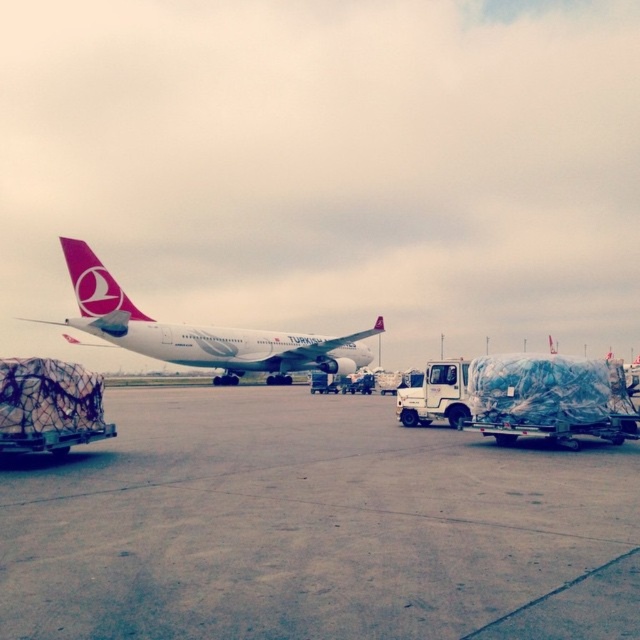
Can you confirm if concrete tarmac at center is wider than pink matte airplane tail at upper left?

Yes.

Who is higher up, concrete tarmac at center or pink matte airplane tail at upper left?

pink matte airplane tail at upper left

Find the location of `concrete tarmac at center`. concrete tarmac at center is located at coordinates (308, 525).

Locate an element on the screen. concrete tarmac at center is located at coordinates (308, 525).

How much distance is there between white glossy airplane at center and pink matte airplane tail at upper left?

The distance of white glossy airplane at center from pink matte airplane tail at upper left is 7.82 meters.

The width and height of the screenshot is (640, 640). What do you see at coordinates (198, 332) in the screenshot?
I see `white glossy airplane at center` at bounding box center [198, 332].

Between point (132, 349) and point (74, 248), which one is positioned in front?

Point (74, 248) is in front.

Identify the location of white glossy airplane at center. (198, 332).

Is concrete tarmac at center bigger than white glossy airplane at center?

No, concrete tarmac at center is not bigger than white glossy airplane at center.

Consider the image. Can you confirm if concrete tarmac at center is positioned below white glossy airplane at center?

Answer: Correct, concrete tarmac at center is located below white glossy airplane at center.

Is point (6, 628) behind point (276, 339)?

No, (6, 628) is in front of (276, 339).

Image resolution: width=640 pixels, height=640 pixels. I want to click on concrete tarmac at center, so click(x=308, y=525).